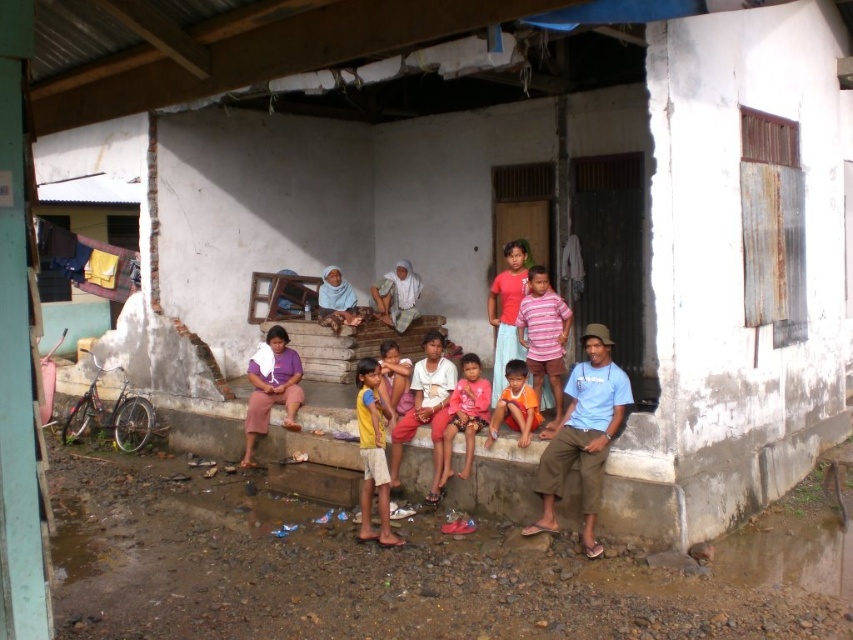
Question: Which of the following is the closest to the observer?

Choices:
 (A) (386, 364)
 (B) (445, 436)

Answer: (B)

Question: Does blue cotton shirt at center appear under matte pink shirt at center?

Choices:
 (A) no
 (B) yes

Answer: (B)

Question: Is yellow cotton shirt at center to the right of orange cotton shirt at center from the viewer's perspective?

Choices:
 (A) no
 (B) yes

Answer: (A)

Question: Which point is farther to the camera?

Choices:
 (A) yellow cotton shirt at center
 (B) purple fabric at center
 (C) blue cotton shirt at center

Answer: (B)

Question: Is matte blue shirt at center in front of blue cotton shirt at center?

Choices:
 (A) yes
 (B) no

Answer: (B)

Question: Which point appears closest to the camera in this image?

Choices:
 (A) (583, 538)
 (B) (358, 404)
 (C) (590, 349)
 (D) (479, 360)

Answer: (A)